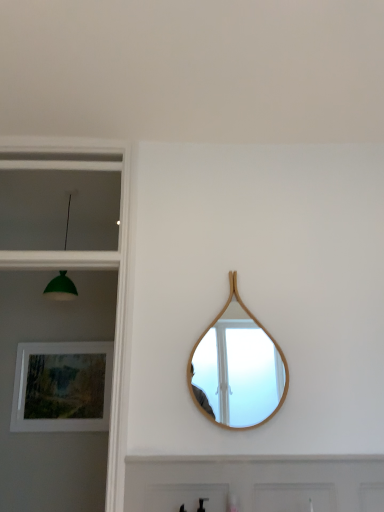
Question: From the image's perspective, is white painted wood door at lower center positioned above or below wooden mirror at center?

Choices:
 (A) below
 (B) above

Answer: (A)

Question: Considering the positions of white painted wood door at lower center and wooden mirror at center in the image, is white painted wood door at lower center wider or thinner than wooden mirror at center?

Choices:
 (A) wide
 (B) thin

Answer: (A)

Question: Which object is positioned closest to the matte wooden picture frame at lower left?

Choices:
 (A) wooden mirror at center
 (B) green matte lampshade at left
 (C) white painted wood door at lower center
 (D) matte glass window at upper left

Answer: (B)

Question: Estimate the real-world distances between objects in this image. Which object is farther from the green matte lampshade at left?

Choices:
 (A) matte wooden picture frame at lower left
 (B) matte glass window at upper left
 (C) wooden mirror at center
 (D) white painted wood door at lower center

Answer: (D)